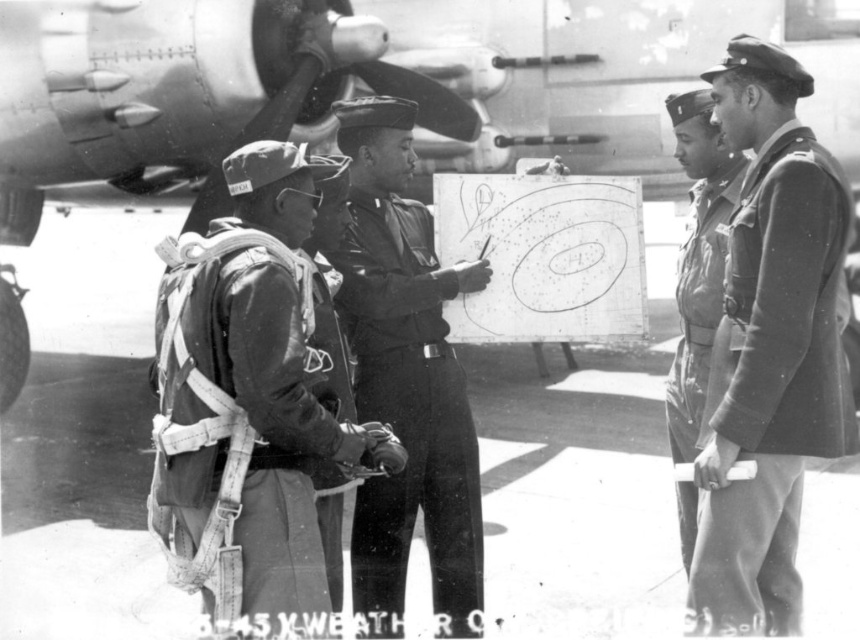
Based on the scene description, which object is positioned further away from the observer? The uniform fabric at center or the camouflage fabric uniform at right?

The camouflage fabric uniform at right is behind the uniform fabric at center, so it is positioned further away from the observer.

You are a photographer trying to capture a clear photo of the camouflage fabric uniform at right. However, the camouflage fabric parachute at left is blocking your view. Can you move the parachute to the side to get a clear shot?

The camouflage fabric parachute at left is in front of the camouflage fabric uniform at right, so moving it to the side would allow you to see the camouflage fabric uniform at right clearly.

You are a member of the military unit observing the metallic aircraft at center and the uniform fabric at center. Which object is closer to the ground?

The uniform fabric at center is closer to the ground because the metallic aircraft at center is positioned over it.